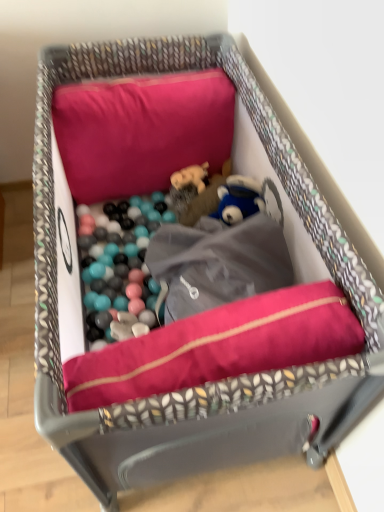
Identify the location of matte pink pillow at upper center. The width and height of the screenshot is (384, 512). (141, 131).

The image size is (384, 512). Describe the element at coordinates (141, 131) in the screenshot. I see `matte pink pillow at upper center` at that location.

What do you see at coordinates (220, 347) in the screenshot? I see `velvet-like pink cushion at center` at bounding box center [220, 347].

You are a GUI agent. You are given a task and a screenshot of the screen. Output one action in this format:
    pyautogui.click(x=<x>, y=<y>)
    Task: Click on the velvet-like pink cushion at center
    
    Given the screenshot: What is the action you would take?
    pyautogui.click(x=220, y=347)

Where is `matte pink pillow at upper center`? The width and height of the screenshot is (384, 512). matte pink pillow at upper center is located at coordinates (141, 131).

Does velvet-like pink cushion at center appear on the right side of matte pink pillow at upper center?

Correct, you'll find velvet-like pink cushion at center to the right of matte pink pillow at upper center.

Which object is more forward, velvet-like pink cushion at center or matte pink pillow at upper center?

velvet-like pink cushion at center is more forward.

Considering the points (248, 322) and (114, 124), which point is behind, point (248, 322) or point (114, 124)?

The point (114, 124) is behind.

From the image's perspective, is velvet-like pink cushion at center below matte pink pillow at upper center?

Yes, from the image's perspective, velvet-like pink cushion at center is beneath matte pink pillow at upper center.

From a real-world perspective, which object stands above the other?

From a 3D spatial view, matte pink pillow at upper center is above.

Considering the sizes of objects velvet-like pink cushion at center and matte pink pillow at upper center in the image provided, who is thinner, velvet-like pink cushion at center or matte pink pillow at upper center?

Thinner between the two is velvet-like pink cushion at center.

From their relative heights in the image, would you say velvet-like pink cushion at center is taller or shorter than matte pink pillow at upper center?

velvet-like pink cushion at center is shorter than matte pink pillow at upper center.

Is velvet-like pink cushion at center smaller than matte pink pillow at upper center?

Yes.

Is matte pink pillow at upper center inside velvet-like pink cushion at center?

No, velvet-like pink cushion at center does not contain matte pink pillow at upper center.

Is the surface of velvet-like pink cushion at center in direct contact with matte pink pillow at upper center?

No.

Does velvet-like pink cushion at center turn towards matte pink pillow at upper center?

Yes, velvet-like pink cushion at center is facing matte pink pillow at upper center.

How different are the orientations of velvet-like pink cushion at center and matte pink pillow at upper center in degrees?

Answer: velvet-like pink cushion at center and matte pink pillow at upper center are facing 85.6 degrees away from each other.

I want to click on pillow above the velvet-like pink cushion at center (from the image's perspective), so click(x=141, y=131).

Does matte pink pillow at upper center appear on the left side of velvet-like pink cushion at center?

Yes, matte pink pillow at upper center is to the left of velvet-like pink cushion at center.

Is matte pink pillow at upper center in front of velvet-like pink cushion at center?

No.

Which is in front, point (127, 105) or point (289, 305)?

The point (289, 305) is closer to the camera.

From the image's perspective, is matte pink pillow at upper center on velvet-like pink cushion at center?

Indeed, from the image's perspective, matte pink pillow at upper center is shown above velvet-like pink cushion at center.

In the scene shown: From a real-world perspective, is matte pink pillow at upper center physically below velvet-like pink cushion at center?

Actually, matte pink pillow at upper center is physically above velvet-like pink cushion at center in the real world.

In the scene shown: Does matte pink pillow at upper center have a lesser width compared to velvet-like pink cushion at center?

No, matte pink pillow at upper center is not thinner than velvet-like pink cushion at center.

Which of these two, matte pink pillow at upper center or velvet-like pink cushion at center, stands taller?

matte pink pillow at upper center is taller.

Is matte pink pillow at upper center bigger than velvet-like pink cushion at center?

Correct, matte pink pillow at upper center is larger in size than velvet-like pink cushion at center.

Which is correct: matte pink pillow at upper center is inside velvet-like pink cushion at center, or outside of it?

matte pink pillow at upper center is outside velvet-like pink cushion at center.

Are matte pink pillow at upper center and velvet-like pink cushion at center located far from each other?

matte pink pillow at upper center is near velvet-like pink cushion at center, not far away.

Is matte pink pillow at upper center positioned with its back to velvet-like pink cushion at center?

matte pink pillow at upper center is not turned away from velvet-like pink cushion at center.

What's the angular difference between matte pink pillow at upper center and velvet-like pink cushion at center's facing directions?

85.6 degrees separate the facing orientations of matte pink pillow at upper center and velvet-like pink cushion at center.

Identify the location of dog bed that is below the matte pink pillow at upper center (from the image's perspective). This screenshot has width=384, height=512. (220, 347).

The height and width of the screenshot is (512, 384). What are the coordinates of `dog bed in front of the matte pink pillow at upper center` in the screenshot? It's located at click(220, 347).

Identify the location of dog bed that appears below the matte pink pillow at upper center (from a real-world perspective). (220, 347).